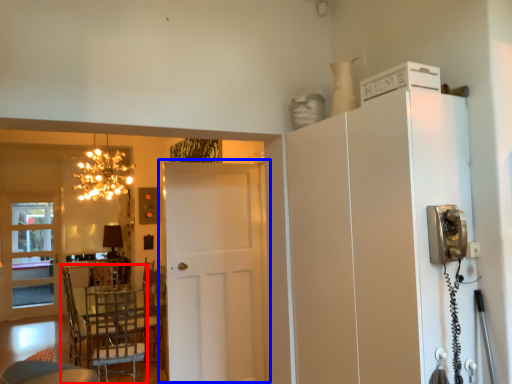
Question: Which of the following is the closest to the observer, chair (highlighted by a red box) or door (highlighted by a blue box)?

Choices:
 (A) chair
 (B) door

Answer: (B)